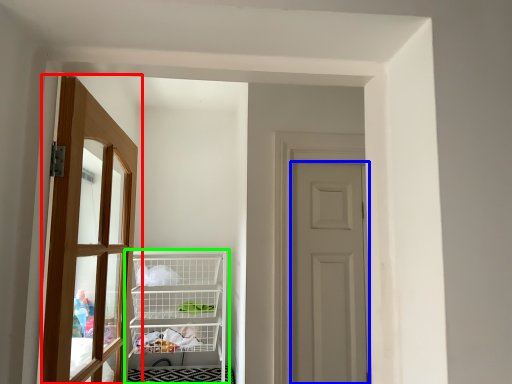
Question: Which is farther away from door (highlighted by a red box)? door (highlighted by a blue box) or shelf (highlighted by a green box)?

Choices:
 (A) door
 (B) shelf

Answer: (A)